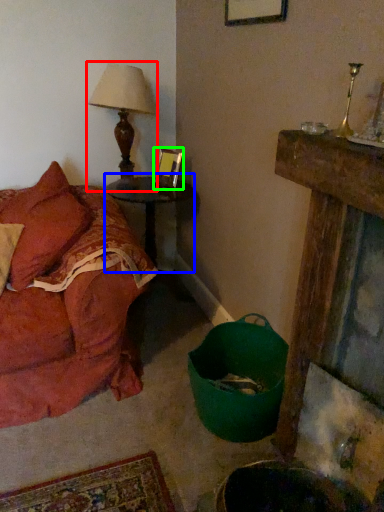
Question: Estimate the real-world distances between objects in this image. Which object is closer to table lamp (highlighted by a red box), table (highlighted by a blue box) or picture frame (highlighted by a green box)?

Choices:
 (A) table
 (B) picture frame

Answer: (B)